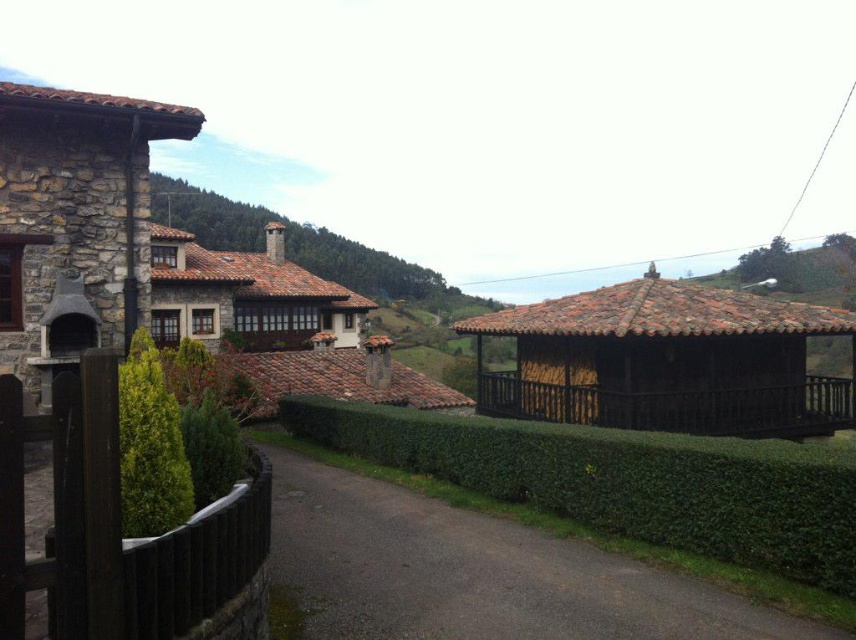
Can you confirm if stone chimney at left is shorter than brown wooden hut at center right?

In fact, stone chimney at left may be taller than brown wooden hut at center right.

Can you confirm if stone chimney at left is smaller than brown wooden hut at center right?

Actually, stone chimney at left might be larger than brown wooden hut at center right.

Which is behind, point (66, 307) or point (721, 298)?

The point (721, 298) is behind.

Identify the location of stone chimney at left. The width and height of the screenshot is (856, 640). (159, 262).

Does green leafy hedge at center have a lesser width compared to brown tiled roof at center?

Yes, green leafy hedge at center is thinner than brown tiled roof at center.

Does green leafy hedge at center appear under brown tiled roof at center?

Yes.

Where is `green leafy hedge at center`? green leafy hedge at center is located at coordinates (623, 481).

Does stone chimney at left appear over green leafy hedge at center?

Yes.

How much distance is there between stone chimney at left and green leafy hedge at center?

stone chimney at left and green leafy hedge at center are 9.53 meters apart from each other.

Identify the location of stone chimney at left. This screenshot has height=640, width=856. (159, 262).